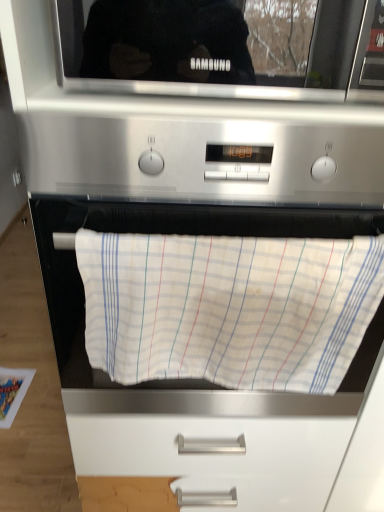
Question: Is black glossy microwave at upper center positioned before white cotton towel at center?

Choices:
 (A) no
 (B) yes

Answer: (B)

Question: From a real-world perspective, is black glossy microwave at upper center positioned under white cotton towel at center based on gravity?

Choices:
 (A) yes
 (B) no

Answer: (B)

Question: Does black glossy microwave at upper center have a larger size compared to white cotton towel at center?

Choices:
 (A) yes
 (B) no

Answer: (A)

Question: Is black glossy microwave at upper center far from white cotton towel at center?

Choices:
 (A) yes
 (B) no

Answer: (B)

Question: Is black glossy microwave at upper center oriented towards white cotton towel at center?

Choices:
 (A) no
 (B) yes

Answer: (A)

Question: From a real-world perspective, is black glossy microwave at upper center positioned over white cotton towel at center based on gravity?

Choices:
 (A) no
 (B) yes

Answer: (B)

Question: From the image's perspective, is white cotton towel at center over black glossy microwave at upper center?

Choices:
 (A) yes
 (B) no

Answer: (B)

Question: Is white cotton towel at center not near black glossy microwave at upper center?

Choices:
 (A) no
 (B) yes

Answer: (A)

Question: Can you confirm if white cotton towel at center is bigger than black glossy microwave at upper center?

Choices:
 (A) no
 (B) yes

Answer: (A)

Question: From a real-world perspective, is white cotton towel at center over black glossy microwave at upper center?

Choices:
 (A) no
 (B) yes

Answer: (A)

Question: Is white cotton towel at center oriented away from black glossy microwave at upper center?

Choices:
 (A) no
 (B) yes

Answer: (A)

Question: Can we say white cotton towel at center lies outside black glossy microwave at upper center?

Choices:
 (A) no
 (B) yes

Answer: (B)

Question: In terms of height, does black glossy microwave at upper center look taller or shorter compared to white cotton towel at center?

Choices:
 (A) tall
 (B) short

Answer: (B)